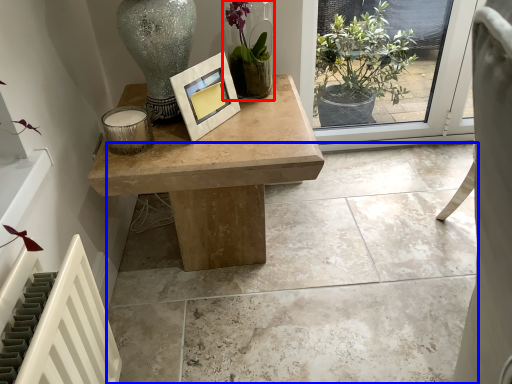
Question: Which object appears farthest to the camera in this image, houseplant (highlighted by a red box) or concrete (highlighted by a blue box)?

Choices:
 (A) houseplant
 (B) concrete

Answer: (A)